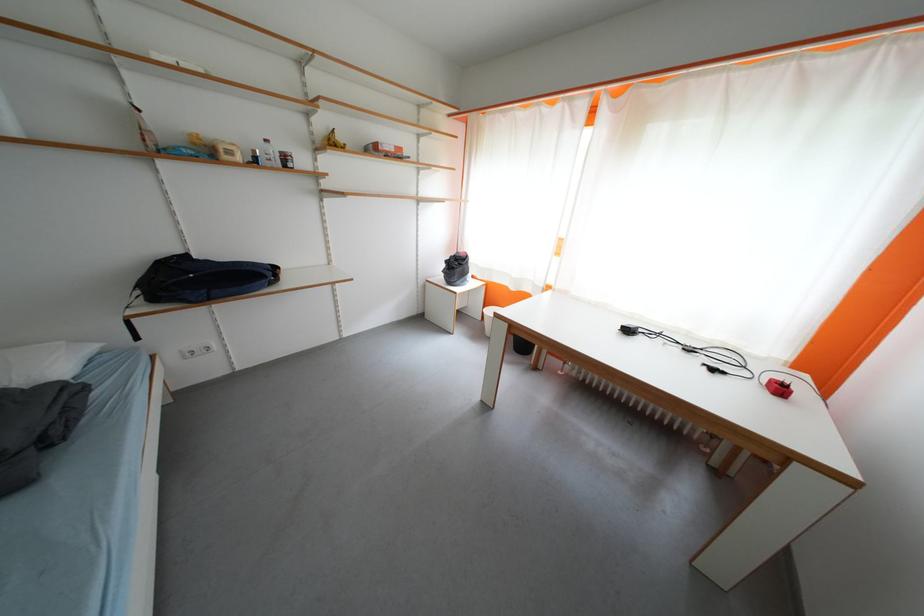
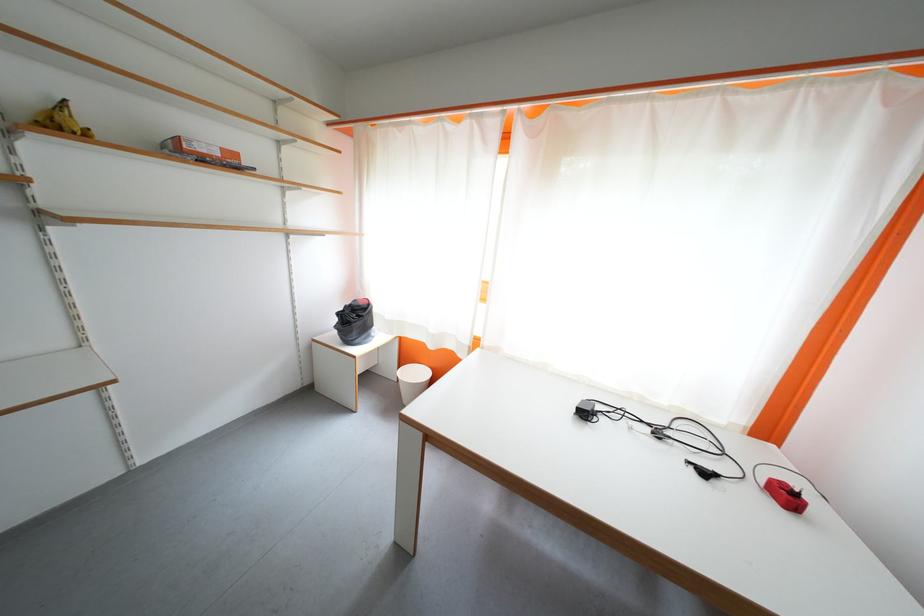
Locate, in the second image, the point that corresponds to (521,292) in the first image.

(440, 350)